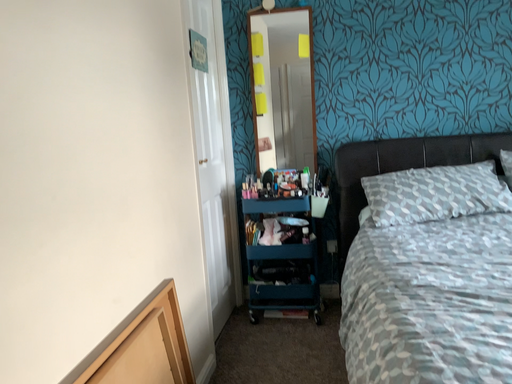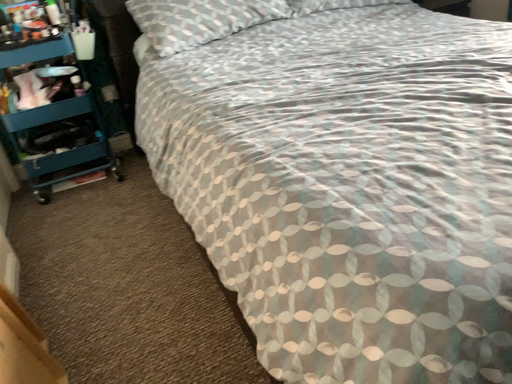
Question: How did the camera likely rotate when shooting the video?

Choices:
 (A) rotated right
 (B) rotated left

Answer: (A)